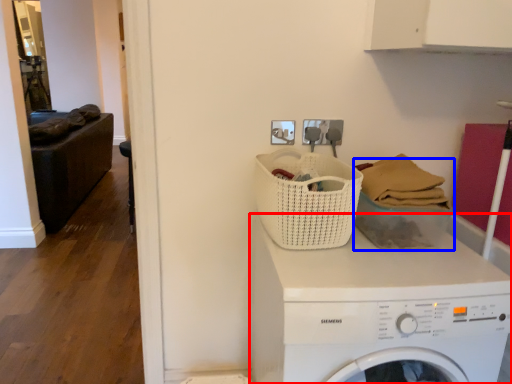
Question: Which of the following is the farthest to the observer, washing machine (highlighted by a red box) or basket (highlighted by a blue box)?

Choices:
 (A) washing machine
 (B) basket

Answer: (B)